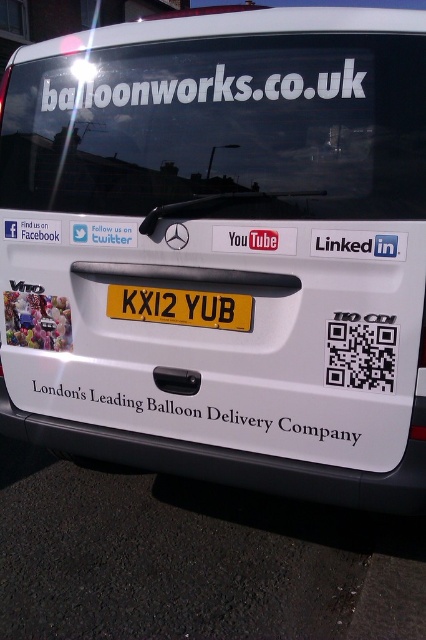
Is transparent glass windshield at upper center shorter than white paper sticker at center?

No.

Which is above, transparent glass windshield at upper center or white paper sticker at center?

transparent glass windshield at upper center is above.

Does point (158, 122) come closer to viewer compared to point (129, 240)?

Yes, point (158, 122) is in front of point (129, 240).

The width and height of the screenshot is (426, 640). I want to click on transparent glass windshield at upper center, so click(x=221, y=128).

Which is in front, point (400, 177) or point (210, 310)?

Point (400, 177) is more forward.

Find the location of a particular element. Image resolution: width=426 pixels, height=640 pixels. transparent glass windshield at upper center is located at coordinates (221, 128).

Who is shorter, white matte text at center or yellow matte license plate at center?

yellow matte license plate at center

Between point (224, 401) and point (215, 305), which one is positioned behind?

Positioned behind is point (224, 401).

You are a GUI agent. You are given a task and a screenshot of the screen. Output one action in this format:
    pyautogui.click(x=<x>, y=<y>)
    Task: Click on the white matte text at center
    The height and width of the screenshot is (640, 426).
    Given the screenshot: What is the action you would take?
    pyautogui.click(x=215, y=413)